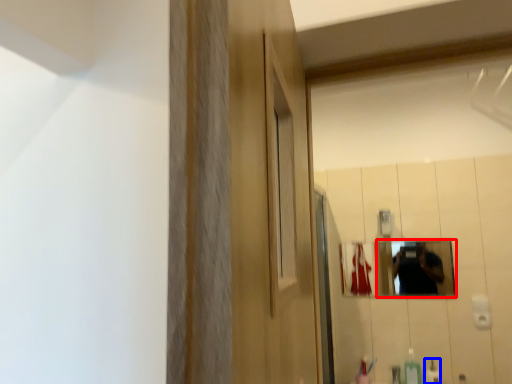
Question: Which of the following is the closest to the observer, mirror (highlighted by a red box) or mouthwash (highlighted by a blue box)?

Choices:
 (A) mirror
 (B) mouthwash

Answer: (B)